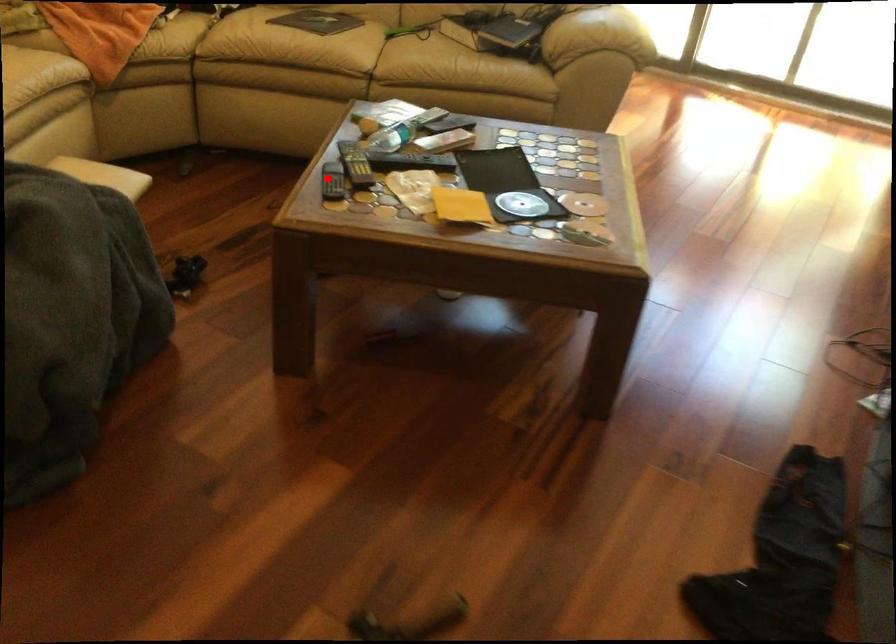
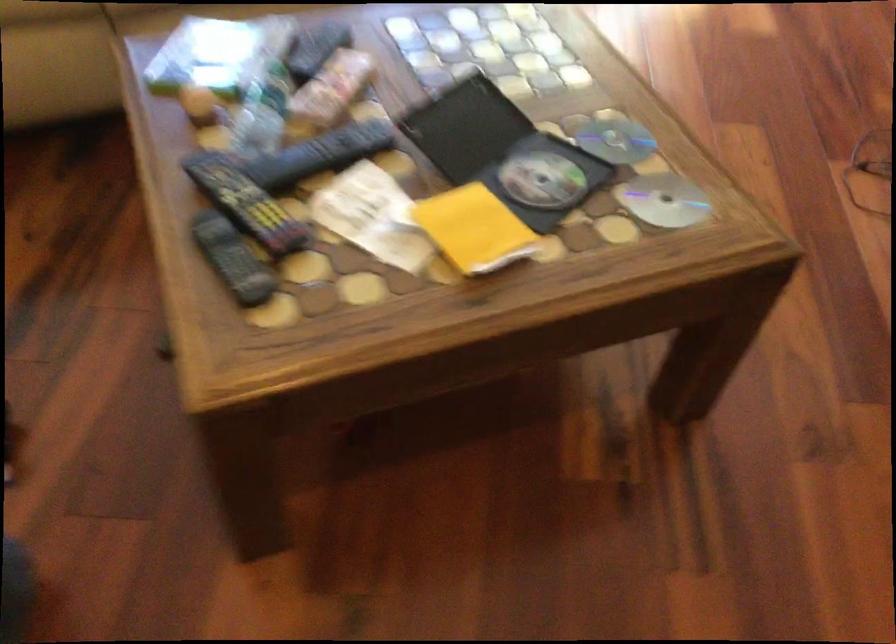
Question: I am providing you with two images of the same scene from different viewpoints. In image1, a red point is highlighted. Considering the same 3D point in image2, which of the following is correct?

Choices:
 (A) It is closer
 (B) It is farther

Answer: (A)